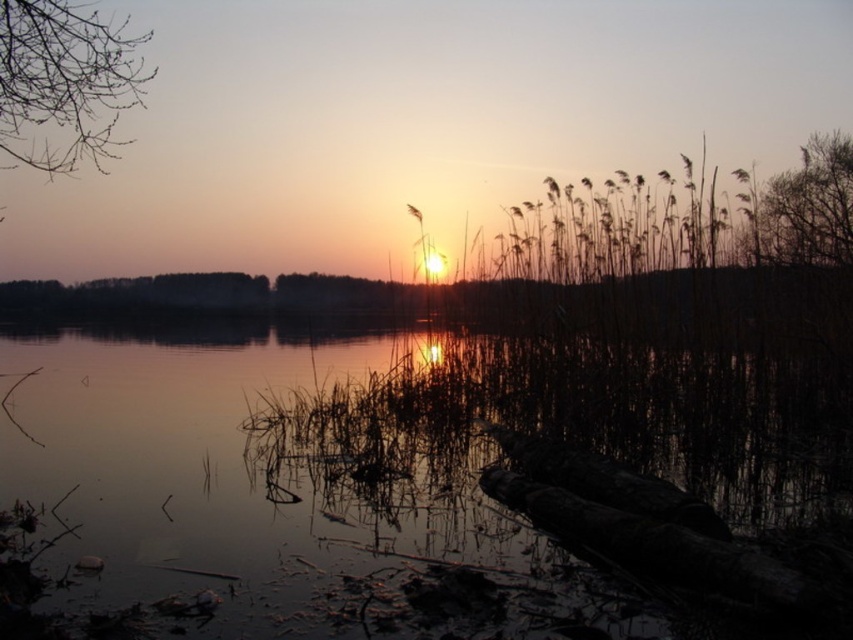
Which is behind, point (149, 438) or point (35, 72)?

Point (149, 438)

The width and height of the screenshot is (853, 640). In order to click on transparent water at center in this screenshot , I will do `click(360, 442)`.